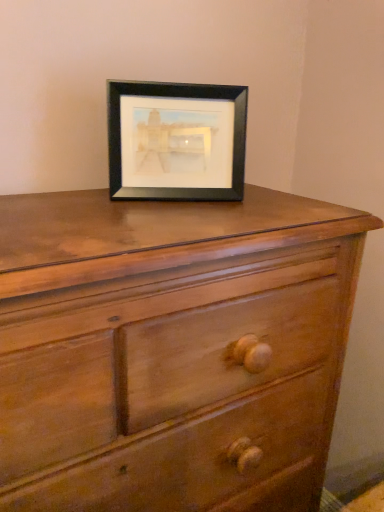
The image size is (384, 512). What do you see at coordinates (171, 350) in the screenshot?
I see `matte wood chest of drawers at center` at bounding box center [171, 350].

Consider the image. Measure the distance between point (219, 290) and camera.

Point (219, 290) is 64.60 centimeters from camera.

Locate an element on the screen. Image resolution: width=384 pixels, height=512 pixels. matte wood chest of drawers at center is located at coordinates (171, 350).

This screenshot has height=512, width=384. What do you see at coordinates (176, 141) in the screenshot?
I see `black matte picture frame at upper center` at bounding box center [176, 141].

This screenshot has width=384, height=512. I want to click on black matte picture frame at upper center, so click(176, 141).

Measure the distance between point (221, 104) and camera.

They are 32.60 inches apart.

You are a GUI agent. You are given a task and a screenshot of the screen. Output one action in this format:
    pyautogui.click(x=<x>, y=<y>)
    Task: Click on the matte wood chest of drawers at center
    This screenshot has height=512, width=384.
    Given the screenshot: What is the action you would take?
    point(171,350)

Considering the relative positions of matte wood chest of drawers at center and black matte picture frame at upper center in the image provided, is matte wood chest of drawers at center to the left or to the right of black matte picture frame at upper center?

From the image, it's evident that matte wood chest of drawers at center is to the left of black matte picture frame at upper center.

In the image, is matte wood chest of drawers at center positioned in front of or behind black matte picture frame at upper center?

Visually, matte wood chest of drawers at center is located in front of black matte picture frame at upper center.

Which is farther, (214, 372) or (128, 135)?

The point (128, 135) is farther from the camera.

From the image's perspective, is matte wood chest of drawers at center located above or below black matte picture frame at upper center?

matte wood chest of drawers at center is situated lower than black matte picture frame at upper center in the image.

From a real-world perspective, is matte wood chest of drawers at center positioned under black matte picture frame at upper center based on gravity?

Yes, from a real-world perspective, matte wood chest of drawers at center is below black matte picture frame at upper center.

Is matte wood chest of drawers at center thinner than black matte picture frame at upper center?

Incorrect, the width of matte wood chest of drawers at center is not less than that of black matte picture frame at upper center.

Considering the sizes of objects matte wood chest of drawers at center and black matte picture frame at upper center in the image provided, who is shorter, matte wood chest of drawers at center or black matte picture frame at upper center?

With less height is black matte picture frame at upper center.

Does matte wood chest of drawers at center have a larger size compared to black matte picture frame at upper center?

Yes.

Would you say matte wood chest of drawers at center is inside or outside black matte picture frame at upper center?

matte wood chest of drawers at center is outside black matte picture frame at upper center.

Are matte wood chest of drawers at center and black matte picture frame at upper center making contact?

No, matte wood chest of drawers at center is not next to black matte picture frame at upper center.

Could you tell me if matte wood chest of drawers at center is turned towards black matte picture frame at upper center?

No.

Can you tell me how much matte wood chest of drawers at center and black matte picture frame at upper center differ in facing direction?

The facing directions of matte wood chest of drawers at center and black matte picture frame at upper center are 23.3 degrees apart.

Could you measure the distance between matte wood chest of drawers at center and black matte picture frame at upper center?

A distance of 11.01 inches exists between matte wood chest of drawers at center and black matte picture frame at upper center.

Identify the location of chest of drawers in front of the black matte picture frame at upper center. This screenshot has height=512, width=384. (171, 350).

Based on their positions, is black matte picture frame at upper center located to the left or right of matte wood chest of drawers at center?

black matte picture frame at upper center is to the right of matte wood chest of drawers at center.

Considering the positions of objects black matte picture frame at upper center and matte wood chest of drawers at center in the image provided, who is in front, black matte picture frame at upper center or matte wood chest of drawers at center?

matte wood chest of drawers at center is closer to the camera.

Which is behind, point (162, 103) or point (197, 270)?

The point (162, 103) is more distant.

From the image's perspective, is black matte picture frame at upper center located beneath matte wood chest of drawers at center?

Incorrect, from the image's perspective, black matte picture frame at upper center is higher than matte wood chest of drawers at center.

Consider the image. From a real-world perspective, who is located higher, black matte picture frame at upper center or matte wood chest of drawers at center?

black matte picture frame at upper center, from a real-world perspective.

Can you confirm if black matte picture frame at upper center is wider than matte wood chest of drawers at center?

No.

Between black matte picture frame at upper center and matte wood chest of drawers at center, which one has less height?

Standing shorter between the two is black matte picture frame at upper center.

Between black matte picture frame at upper center and matte wood chest of drawers at center, which one has larger size?

With larger size is matte wood chest of drawers at center.

Choose the correct answer: Is black matte picture frame at upper center inside matte wood chest of drawers at center or outside it?

black matte picture frame at upper center is spatially situated outside matte wood chest of drawers at center.

Is black matte picture frame at upper center placed right next to matte wood chest of drawers at center?

black matte picture frame at upper center is not next to matte wood chest of drawers at center, and they're not touching.

Is black matte picture frame at upper center positioned with its back to matte wood chest of drawers at center?

No, black matte picture frame at upper center is not facing the opposite direction of matte wood chest of drawers at center.

What's the angular difference between black matte picture frame at upper center and matte wood chest of drawers at center's facing directions?

They differ by 23.3 degrees in their facing directions.

I want to click on picture frame behind the matte wood chest of drawers at center, so click(x=176, y=141).

Where is `picture frame above the matte wood chest of drawers at center (from a real-world perspective)`? picture frame above the matte wood chest of drawers at center (from a real-world perspective) is located at coordinates (176, 141).

The height and width of the screenshot is (512, 384). In order to click on the chest of drawers that is in front of the black matte picture frame at upper center in this screenshot , I will do `click(171, 350)`.